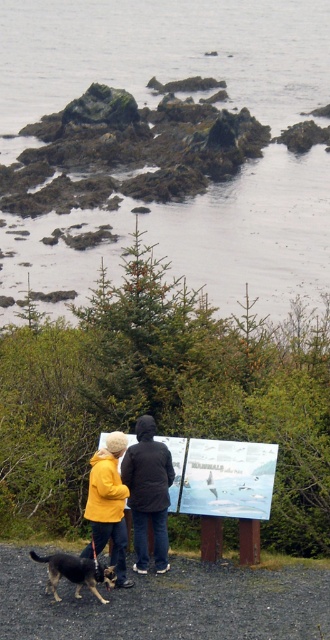
Which is in front, point (67, 84) or point (159, 560)?

Point (159, 560) is in front.

Based on the photo, can you confirm if grayish water at center is positioned above yellow woolen jacket at center?

Correct, grayish water at center is located above yellow woolen jacket at center.

What do you see at coordinates (164, 51) in the screenshot?
I see `grayish water at center` at bounding box center [164, 51].

You are a GUI agent. You are given a task and a screenshot of the screen. Output one action in this format:
    pyautogui.click(x=<x>, y=<y>)
    Task: Click on the grayish water at center
    This screenshot has width=330, height=640.
    Given the screenshot: What is the action you would take?
    pyautogui.click(x=164, y=51)

Can you confirm if gravelly dirt ground at lower center is smaller than brown fur dog at lower left?

Incorrect, gravelly dirt ground at lower center is not smaller in size than brown fur dog at lower left.

Is point (262, 634) positioned in front of point (68, 570)?

That is True.

You are a GUI agent. You are given a task and a screenshot of the screen. Output one action in this format:
    pyautogui.click(x=<x>, y=<y>)
    Task: Click on the gravelly dirt ground at lower center
    
    Given the screenshot: What is the action you would take?
    pos(167,604)

Based on the photo, who is more distant from viewer, (283, 49) or (93, 580)?

The point (283, 49) is behind.

Between point (64, 284) and point (53, 563), which one is positioned in front?

Point (53, 563) is more forward.

Is point (52, 276) positioned after point (111, 580)?

That is True.

Identify the location of grayish water at center. This screenshot has width=330, height=640. (164, 51).